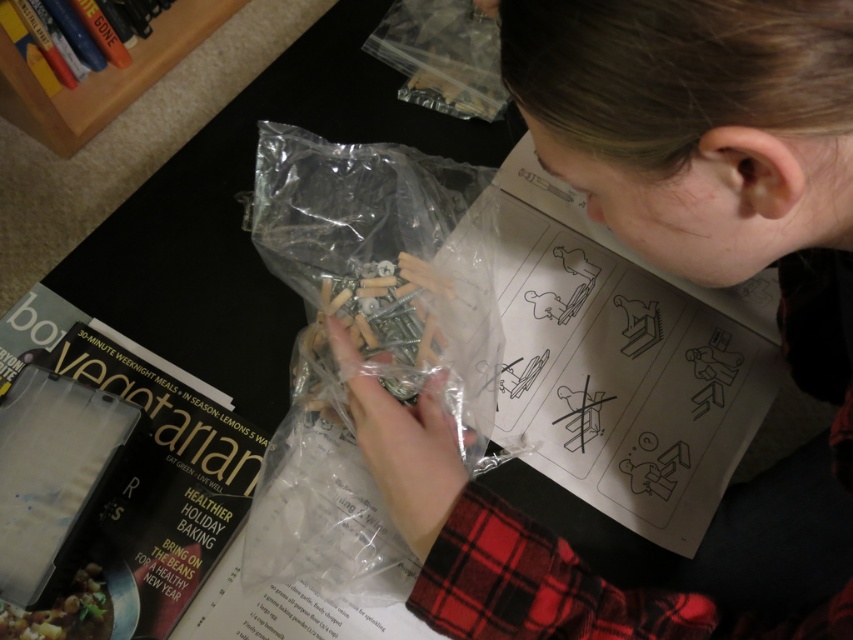
Does point (16, 80) lie in front of point (41, 60)?

Yes, it is in front of point (41, 60).

In the scene shown: Does wooden bookshelf at upper left have a smaller size compared to hardcover book at upper left?

No.

Between point (54, 150) and point (49, 19), which one is positioned behind?

Positioned behind is point (54, 150).

The width and height of the screenshot is (853, 640). I want to click on wooden bookshelf at upper left, so click(103, 77).

Based on the photo, who is lower down, matte black magazine at lower left or hardcover book at upper left?

matte black magazine at lower left

The width and height of the screenshot is (853, 640). Describe the element at coordinates (161, 484) in the screenshot. I see `matte black magazine at lower left` at that location.

Is point (235, 440) positioned before point (67, 51)?

Yes, it is.

The height and width of the screenshot is (640, 853). I want to click on matte black magazine at lower left, so click(x=161, y=484).

Which is more to the left, matte black magazine at lower left or wooden bookshelf at upper left?

wooden bookshelf at upper left is more to the left.

Is point (228, 490) farther from viewer compared to point (213, 12)?

No.

Image resolution: width=853 pixels, height=640 pixels. I want to click on matte black magazine at lower left, so click(161, 484).